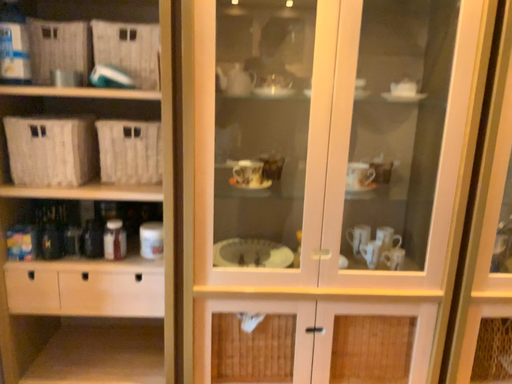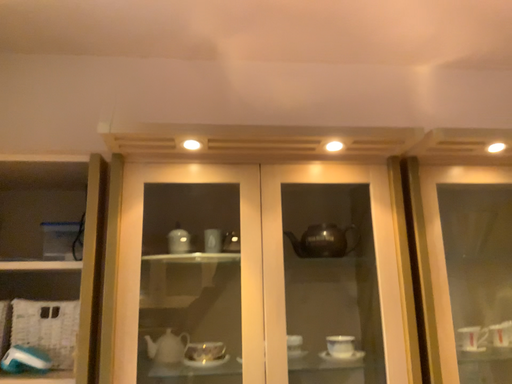
Question: Which way did the camera rotate in the video?

Choices:
 (A) rotated upward
 (B) rotated downward

Answer: (A)